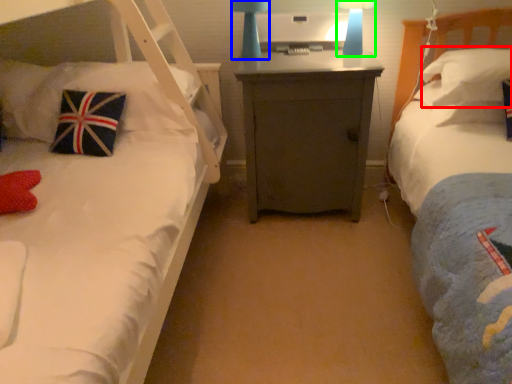
Question: Which object is positioned closest to pillow (highlighted by a red box)? Select from bedside lamp (highlighted by a blue box) and bedside lamp (highlighted by a green box).

Choices:
 (A) bedside lamp
 (B) bedside lamp

Answer: (B)